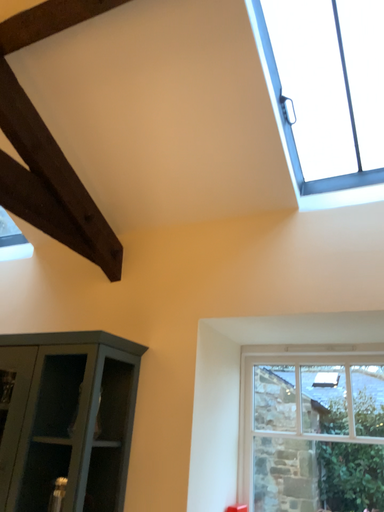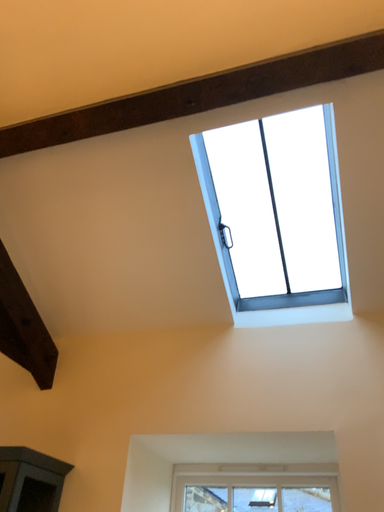
Question: How did the camera likely rotate when shooting the video?

Choices:
 (A) rotated right
 (B) rotated left

Answer: (A)